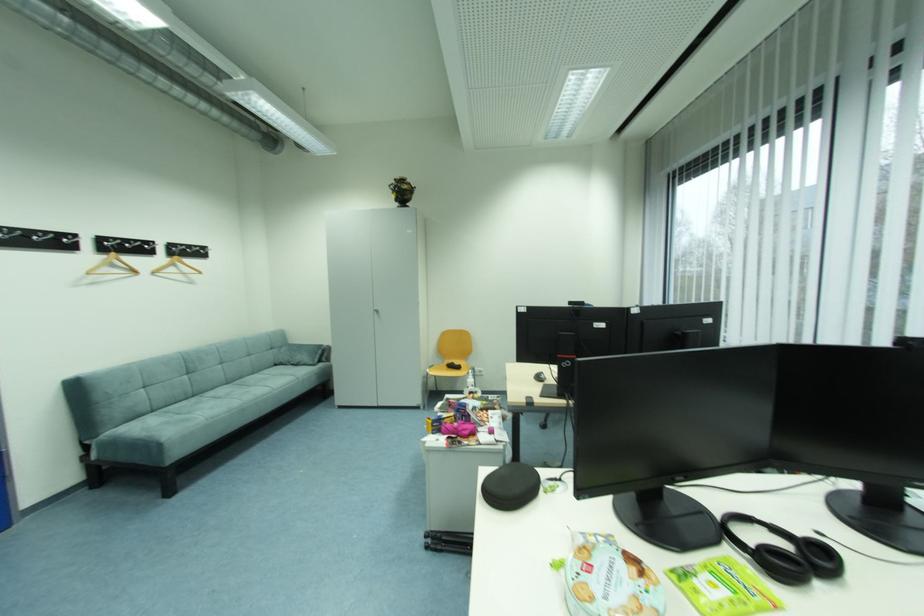
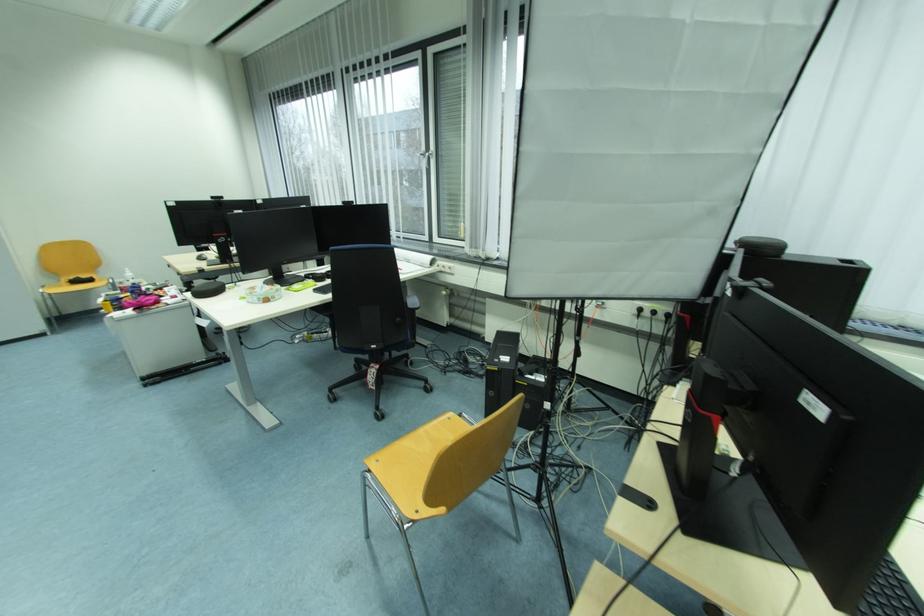
The point at (x=466, y=369) is marked in the first image. Where is the corresponding point in the second image?

(96, 282)